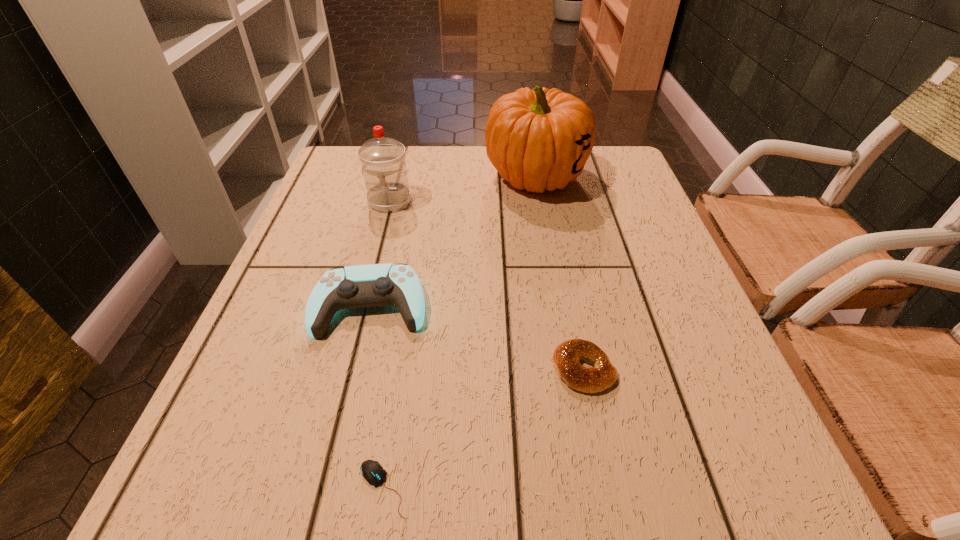
Find the location of a particular element. the tallest object is located at coordinates (538, 139).

Locate an element on the screen. The image size is (960, 540). water bottle is located at coordinates (383, 160).

The width and height of the screenshot is (960, 540). Identify the location of control. (373, 285).

Identify the location of the third tallest object. The image size is (960, 540). (373, 285).

Find the location of a particular element. The height and width of the screenshot is (540, 960). the fourth farthest object is located at coordinates (566, 356).

At what (x,y) coordinates should I click in order to perform the action: click on bagel. Please return your answer as a coordinate pair (x, y). This screenshot has height=540, width=960. Looking at the image, I should click on (566, 356).

The image size is (960, 540). Find the location of `mouse`. mouse is located at coordinates (372, 471).

You are a GUI agent. You are given a task and a screenshot of the screen. Output one action in this format:
    pyautogui.click(x=<x>, y=<y>)
    Task: Click on the nearest object
    The image size is (960, 540).
    Given the screenshot: What is the action you would take?
    pyautogui.click(x=372, y=471)

Locate an element on the screen. free spot located 0.210m on the surface of the pumpkin is located at coordinates (552, 266).

Locate an element on the screen. The image size is (960, 540). vacant region located on the handle side of the second tallest object is located at coordinates (364, 300).